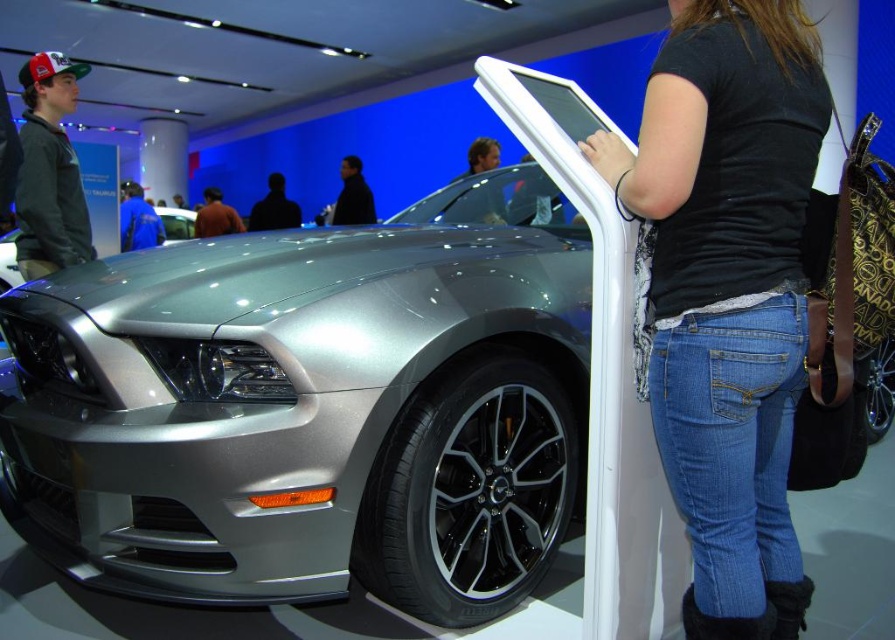
You are a photographer at the auto show trying to capture the brown sweater at center and the satin silver car at center in a single frame. Given that your camera has a fixed focal length and limited field of view, which object should you position closer to the camera to ensure both fit within the frame?

Since the brown sweater at center is wider than the satin silver car at center, positioning the brown sweater at center closer to the camera will allow both objects to fit within the frame. This is because objects closer to the camera appear larger, so bringing the wider brown sweater at center nearer would balance their apparent sizes, ensuring both fit in the frame.

You are standing in the auto show and want to take a photo of the satin silver car at center without anyone blocking the view. Is the blue denim jeans at lower right in the way?

The blue denim jeans at lower right is below the satin silver car at center, so it won not block the view of the car.